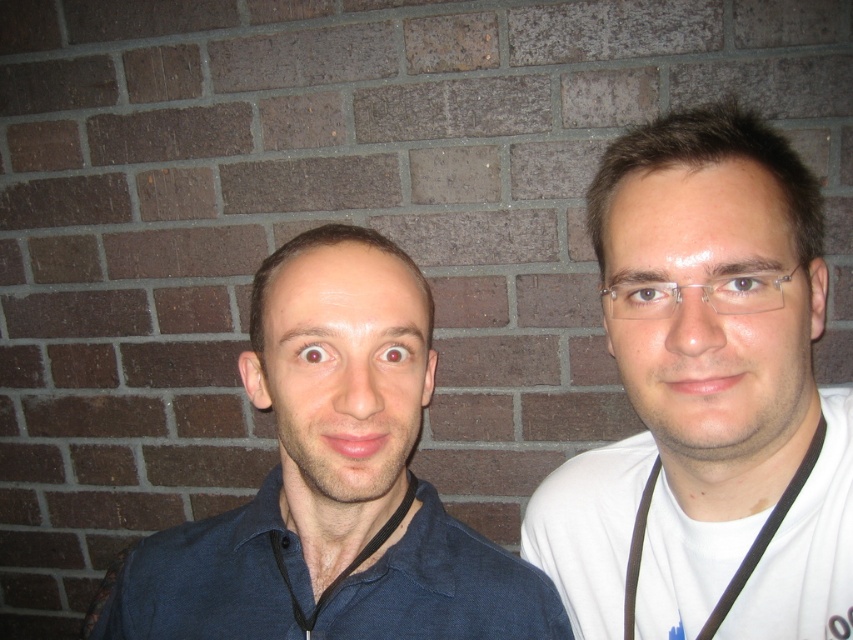
Question: Is matte blue shirt at center closer to camera compared to dark blue cotton polo shirt at left?

Choices:
 (A) no
 (B) yes

Answer: (B)

Question: Does white matte shirt at right appear over matte blue shirt at center?

Choices:
 (A) no
 (B) yes

Answer: (B)

Question: Can you confirm if matte blue shirt at center is thinner than white matte polo shirt at right?

Choices:
 (A) no
 (B) yes

Answer: (A)

Question: Which object is closer to the camera taking this photo?

Choices:
 (A) white matte polo shirt at right
 (B) dark blue cotton polo shirt at left
 (C) white matte shirt at right
 (D) matte blue shirt at center

Answer: (C)

Question: Which point appears closest to the camera in this image?

Choices:
 (A) (787, 625)
 (B) (532, 627)

Answer: (A)

Question: Which point is closer to the camera taking this photo?

Choices:
 (A) (786, 392)
 (B) (805, 625)

Answer: (A)